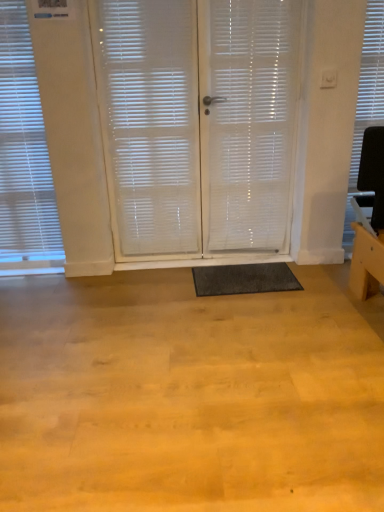
Question: Can you confirm if white translucent blinds at left, the second window blind when ordered from right to left, is bigger than dark gray rubber mat at center?

Choices:
 (A) no
 (B) yes

Answer: (B)

Question: Is white translucent blinds at left, the second window blind when ordered from right to left, oriented away from dark gray rubber mat at center?

Choices:
 (A) no
 (B) yes

Answer: (A)

Question: Can you confirm if white translucent blinds at left, the second window blind when ordered from right to left, is shorter than dark gray rubber mat at center?

Choices:
 (A) no
 (B) yes

Answer: (A)

Question: Is white translucent blinds at left, the second window blind when ordered from right to left, closer to the viewer compared to dark gray rubber mat at center?

Choices:
 (A) yes
 (B) no

Answer: (A)

Question: Is white translucent blinds at left, the second window blind when ordered from right to left, aimed at dark gray rubber mat at center?

Choices:
 (A) no
 (B) yes

Answer: (A)

Question: In terms of height, does white textured blind at upper right, acting as the second window blind starting from the left, look taller or shorter compared to white translucent blinds at left, which is counted as the first window blind, starting from the left?

Choices:
 (A) short
 (B) tall

Answer: (A)

Question: Choose the correct answer: Is white textured blind at upper right, acting as the second window blind starting from the left, inside white translucent blinds at left, the second window blind when ordered from right to left, or outside it?

Choices:
 (A) inside
 (B) outside

Answer: (B)

Question: Would you say white textured blind at upper right, acting as the second window blind starting from the left, is to the left or to the right of white translucent blinds at left, which is counted as the first window blind, starting from the left, in the picture?

Choices:
 (A) left
 (B) right

Answer: (B)

Question: Is white textured blind at upper right, positioned as the 1th window blind in right-to-left order, in front of or behind white translucent blinds at left, which is counted as the first window blind, starting from the left, in the image?

Choices:
 (A) front
 (B) behind

Answer: (B)

Question: From the image's perspective, is white translucent screen door at center, the 1th screen door viewed from the right, above or below dark gray rubber mat at center?

Choices:
 (A) above
 (B) below

Answer: (A)

Question: In terms of width, does white translucent screen door at center, the 1th screen door viewed from the right, look wider or thinner when compared to dark gray rubber mat at center?

Choices:
 (A) wide
 (B) thin

Answer: (B)

Question: Looking at the image, does white translucent screen door at center, the 1th screen door viewed from the right, seem bigger or smaller compared to dark gray rubber mat at center?

Choices:
 (A) big
 (B) small

Answer: (A)

Question: Relative to dark gray rubber mat at center, is white translucent screen door at center, which is the 2th screen door in left-to-right order, in front or behind?

Choices:
 (A) front
 (B) behind

Answer: (A)

Question: Is white translucent curtain at center taller or shorter than white textured blind at upper right, acting as the second window blind starting from the left?

Choices:
 (A) tall
 (B) short

Answer: (A)

Question: Would you say white translucent curtain at center is to the left or to the right of white textured blind at upper right, acting as the second window blind starting from the left, in the picture?

Choices:
 (A) left
 (B) right

Answer: (A)